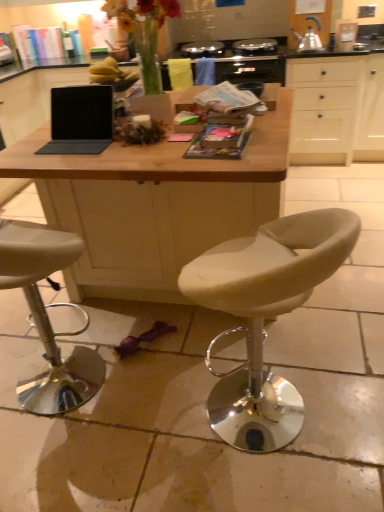
The image size is (384, 512). I want to click on empty space that is in between beige leather stool at lower left, which ranks as the second chair in right-to-left order, and wooden desk at center, so click(143, 386).